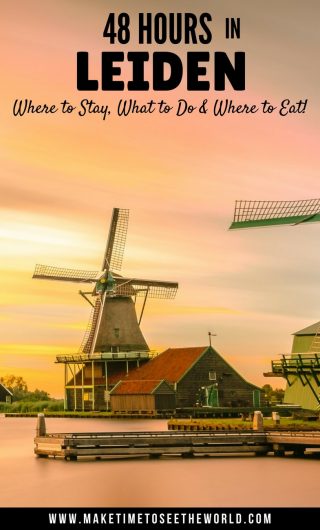
In order to click on doors in this screenshot , I will do (257, 397), (213, 401).